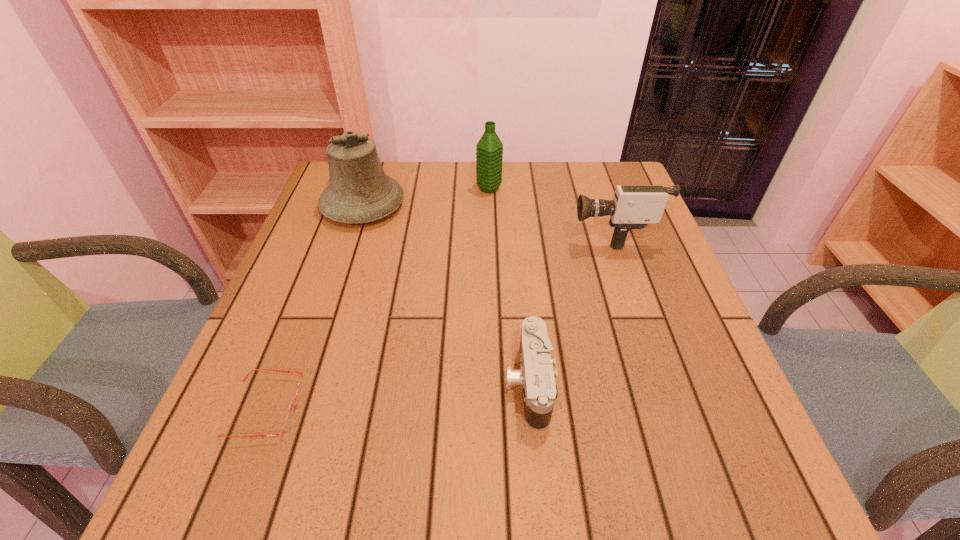
This screenshot has height=540, width=960. I want to click on bell, so click(x=359, y=191).

Locate an element on the screen. The height and width of the screenshot is (540, 960). water bottle is located at coordinates (489, 149).

What are the coordinates of `the rightmost object` in the screenshot? It's located at pyautogui.click(x=634, y=206).

The image size is (960, 540). Identify the location of camcorder. (634, 206).

Where is `camera`? Image resolution: width=960 pixels, height=540 pixels. camera is located at coordinates (536, 378).

The width and height of the screenshot is (960, 540). What are the coordinates of `the shortest object` in the screenshot? It's located at (290, 415).

At what (x,y) coordinates should I click in order to perform the action: click on vacant space located on the right of the bell. Please return your answer as a coordinate pair (x, y). Looking at the image, I should click on (443, 206).

Identify the location of vacant space located on the front of the water bottle. (491, 261).

The height and width of the screenshot is (540, 960). I want to click on vacant region located 0.320m on the recording direction of the camcorder, so click(x=443, y=234).

Image resolution: width=960 pixels, height=540 pixels. I want to click on vacant region located 0.340m on the recording direction of the camcorder, so click(434, 234).